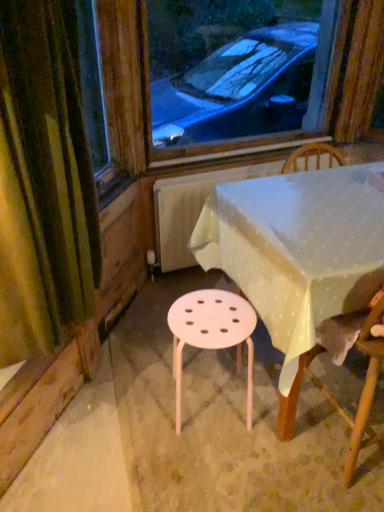
You are a GUI agent. You are given a task and a screenshot of the screen. Output one action in this format:
    pyautogui.click(x=<x>, y=<y>)
    Task: Click on the vacant space to the right of pink plastic stool at center
    
    Given the screenshot: What is the action you would take?
    pyautogui.click(x=272, y=409)